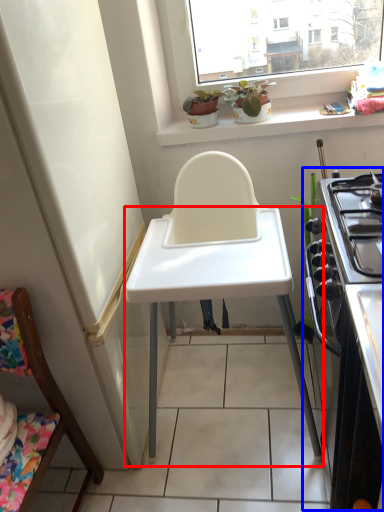
Question: Among these objects, which one is farthest to the camera, table (highlighted by a red box) or appliance (highlighted by a blue box)?

Choices:
 (A) table
 (B) appliance

Answer: (A)